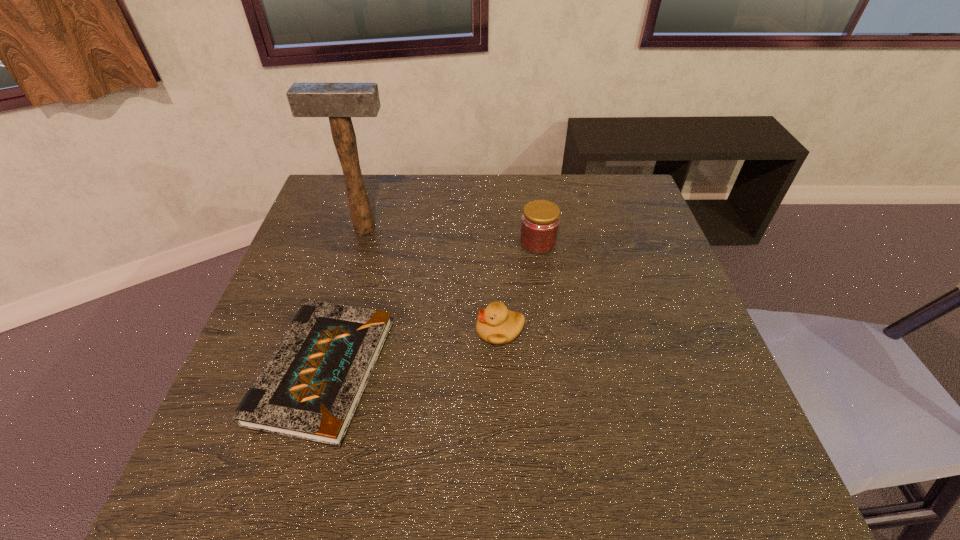
The width and height of the screenshot is (960, 540). In order to click on mallet in this screenshot , I will do `click(339, 101)`.

The width and height of the screenshot is (960, 540). Find the location of `jam`. jam is located at coordinates point(540,221).

This screenshot has width=960, height=540. Find the location of `the rightmost object`. the rightmost object is located at coordinates (540, 221).

Identify the location of duckling. (496, 324).

Locate an element on the screen. the third object from left to right is located at coordinates click(496, 324).

The image size is (960, 540). Identify the location of the shortest object. (310, 389).

Locate an element on the screen. This screenshot has height=540, width=960. vacant space situated on the right of the mallet is located at coordinates (489, 228).

You are a GUI agent. You are given a task and a screenshot of the screen. Output one action in this format:
    pyautogui.click(x=<x>, y=<y>)
    Task: Click on the free space located 0.140m on the right of the jam
    The height and width of the screenshot is (540, 960).
    Given the screenshot: What is the action you would take?
    pyautogui.click(x=608, y=243)

Identify the location of free space located at the beak of the third object from left to right. The width and height of the screenshot is (960, 540). (414, 331).

Locate an element on the screen. free region located at the beak of the third object from left to right is located at coordinates (449, 331).